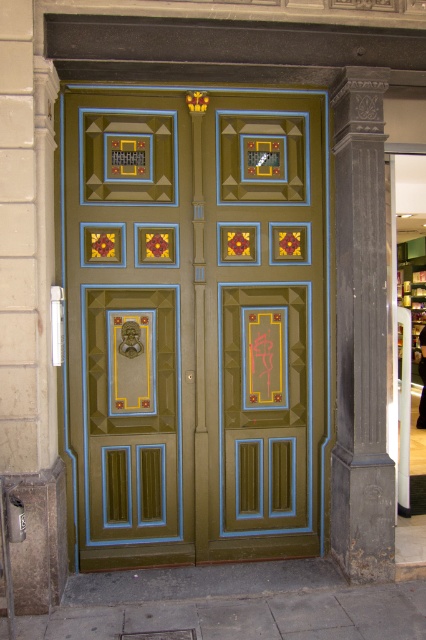
Which is in front, point (169, 166) or point (374, 150)?

Point (374, 150)

Does matte olive-green door at center have a smaller size compared to dark gray stone column at right?

No, matte olive-green door at center is not smaller than dark gray stone column at right.

Is point (175, 260) in front of point (373, 456)?

No, (175, 260) is behind (373, 456).

Identify the location of matte olive-green door at center. The image size is (426, 640). (195, 323).